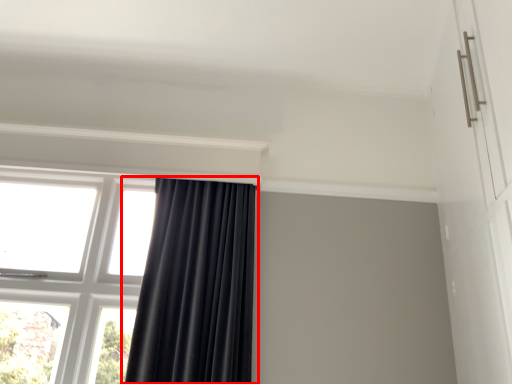
Question: Considering the relative positions of curtain (annotated by the red box) and window in the image provided, where is curtain (annotated by the red box) located with respect to the staircase?

Choices:
 (A) left
 (B) right

Answer: (B)